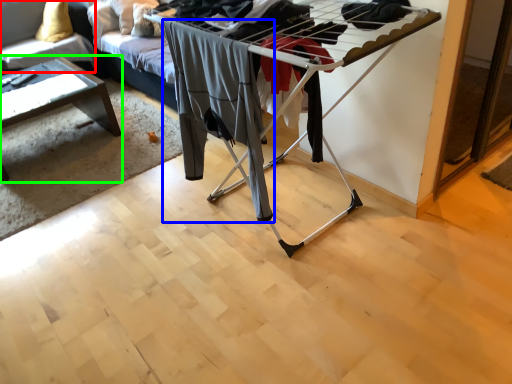
Question: Based on their relative distances, which object is farther from couch (highlighted by a red box)? Choose from clothing (highlighted by a blue box) and table (highlighted by a green box).

Choices:
 (A) clothing
 (B) table

Answer: (A)